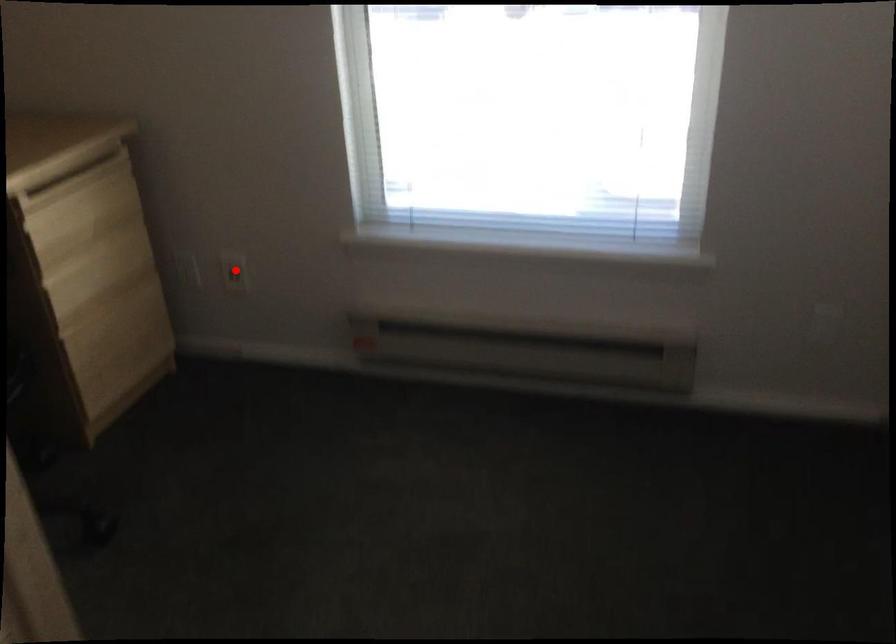
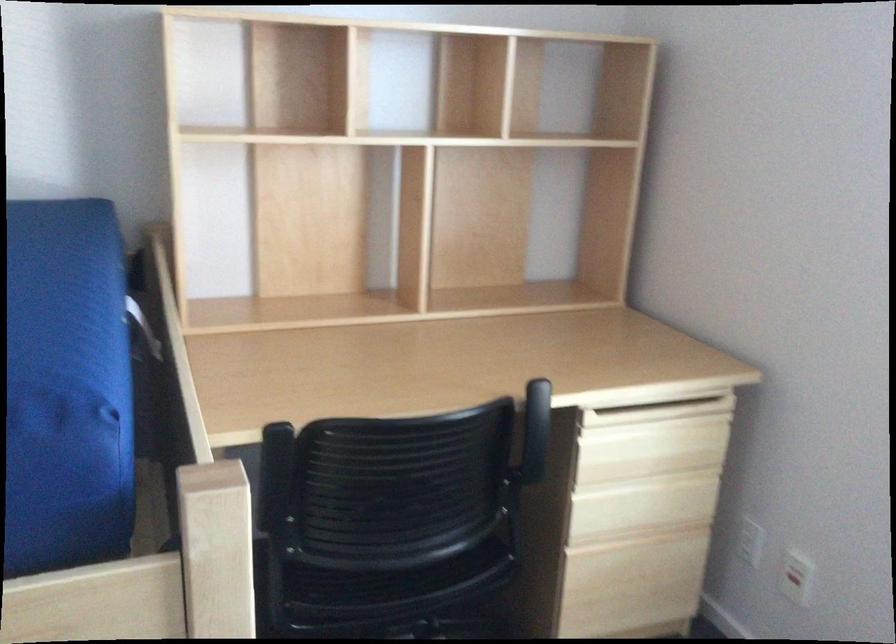
Question: I am providing you with two images of the same scene from different viewpoints. A red point is shown in image1. For the corresponding object point in image2, is it positioned nearer or farther from the camera?

Choices:
 (A) Nearer
 (B) Farther

Answer: (A)